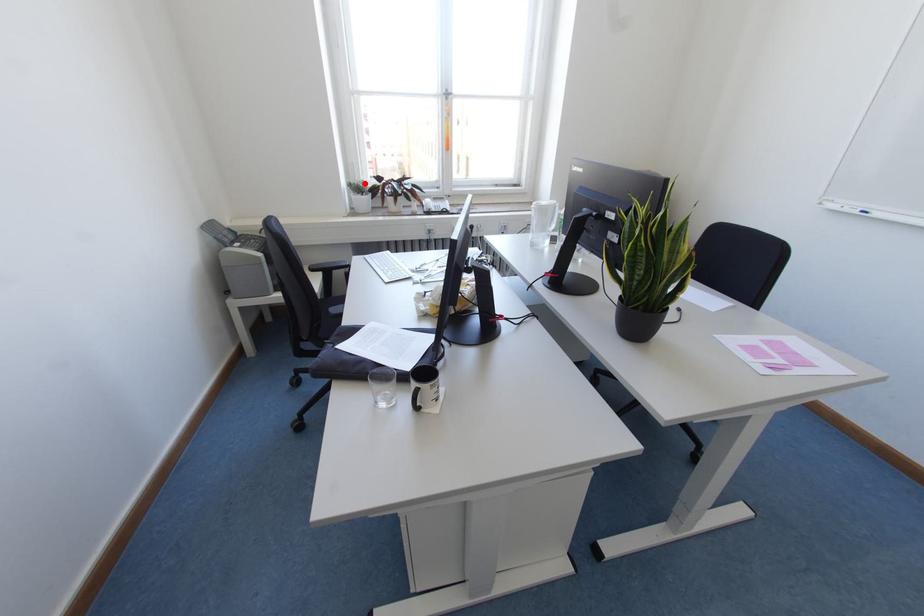
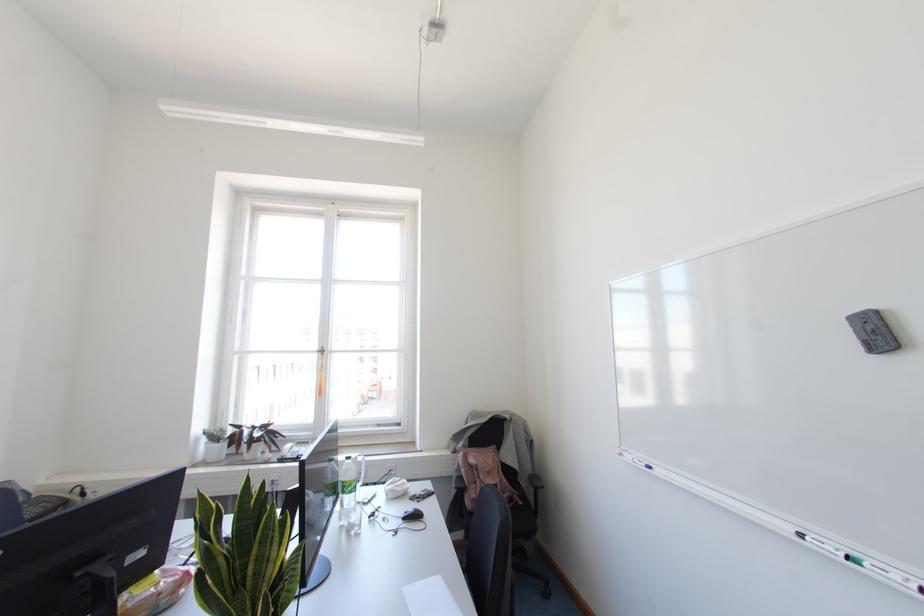
Question: A red point is marked in image1. In image2, is the corresponding 3D point closer to the camera or farther? Reply with the corresponding letter.

Choices:
 (A) The corresponding 3D point is closer.
 (B) The corresponding 3D point is farther.

Answer: (B)